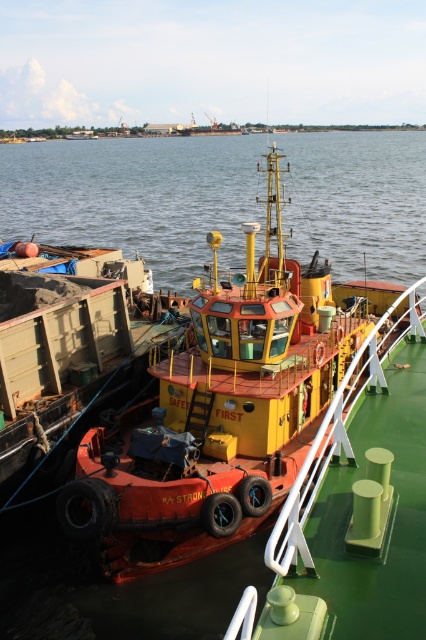
You are a crane operator at the port. You need to lift the rusty metal cargo container at left and place it onto a ship that is currently docked at the clear water at center. The crane has a maximum reach of 50 meters. Can you safely move the container to the ship without extending beyond the crane reach limit?

The clear water at center and rusty metal cargo container at left are 53.71 meters apart. Since the crane can only reach 50 meters, you cannot safely move the container to the ship without exceeding the reach limit.

You are a dock worker standing on the tugboat and need to retrieve an item from the orange rubber boat at center and the rusty metal cargo container at left. Which object will require you to move further away from your current position?

The rusty metal cargo container at left is further away from the viewer than the orange rubber boat at center, so you will need to move further away to reach the rusty metal cargo container at left.

You are a safety inspector checking the port area. You notice an orange rubber boat at center and clear water at center. Which object is smaller in size?

The orange rubber boat at center is smaller than the clear water at center.